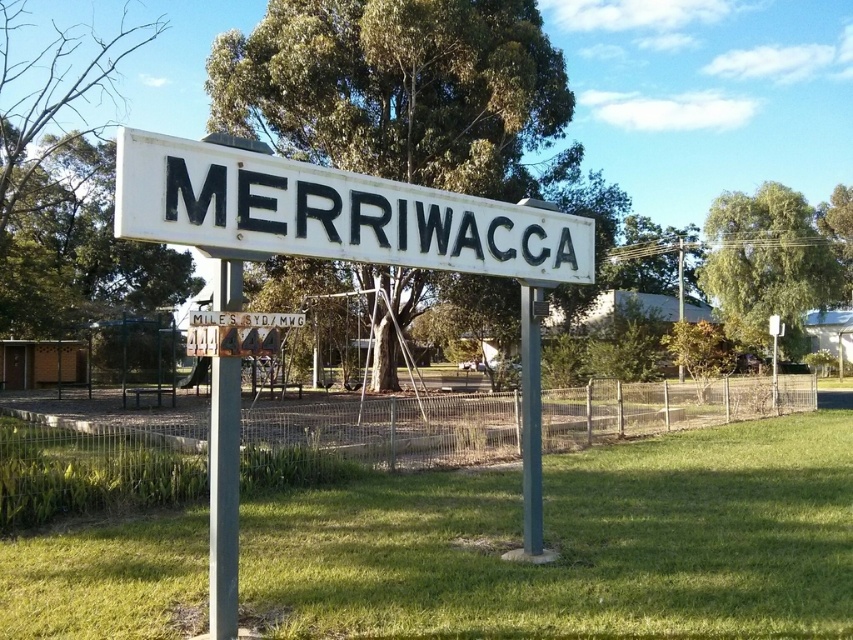
Question: Is green grass at center to the right of green painted metal pole at center from the viewer's perspective?

Choices:
 (A) no
 (B) yes

Answer: (A)

Question: Observing the image, what is the correct spatial positioning of green grass at center in reference to green painted metal pole at center?

Choices:
 (A) above
 (B) below

Answer: (B)

Question: Which object appears closest to the camera in this image?

Choices:
 (A) white matte sign at center
 (B) green grass at center
 (C) green painted metal pole at center

Answer: (A)

Question: Among these points, which one is nearest to the camera?

Choices:
 (A) (323, 170)
 (B) (779, 516)
 (C) (535, 349)

Answer: (A)

Question: Which of the following is the farthest from the observer?

Choices:
 (A) (524, 464)
 (B) (9, 632)

Answer: (A)

Question: Can you confirm if green grass at center is positioned to the right of green painted metal pole at center?

Choices:
 (A) yes
 (B) no

Answer: (B)